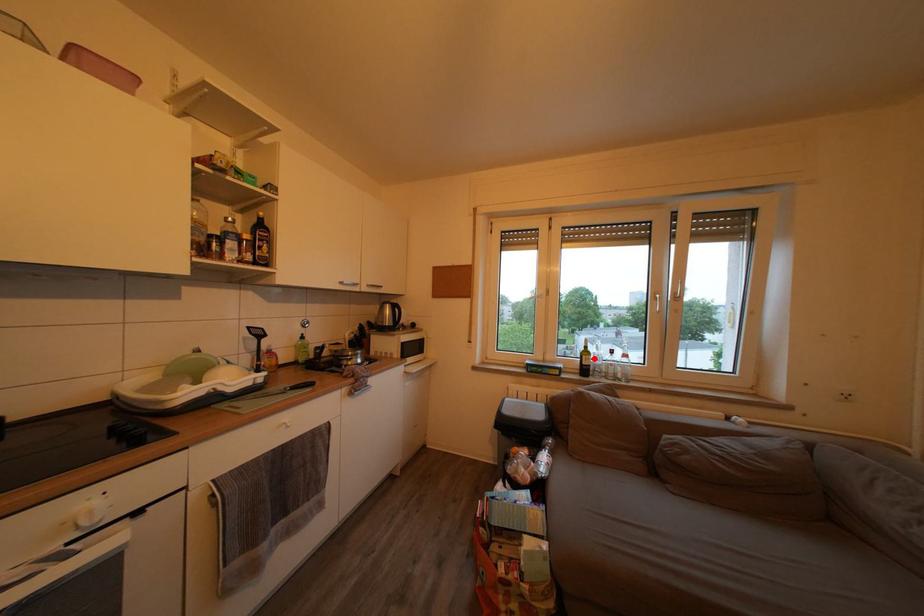
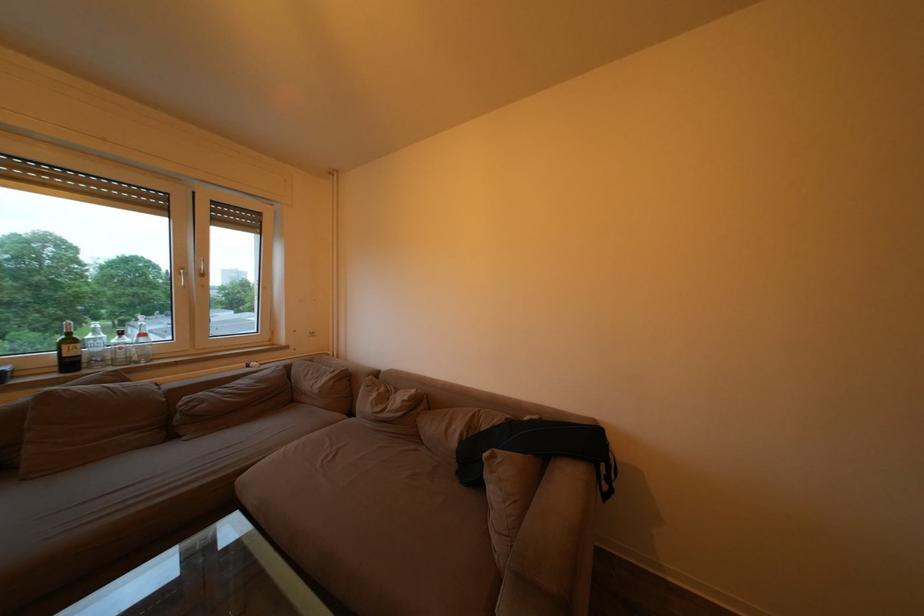
Locate, in the second image, the point that corresponds to the highlighted location in the first image.

(79, 347)